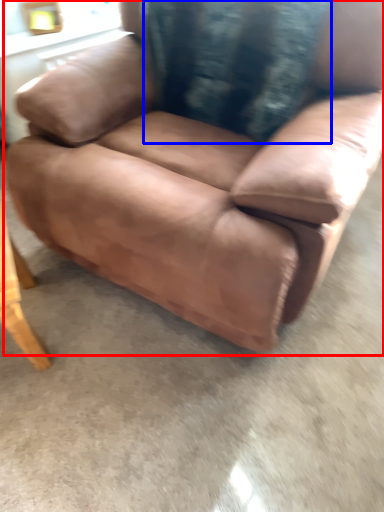
Question: Which of the following is the closest to the observer, chair (highlighted by a red box) or pillow (highlighted by a blue box)?

Choices:
 (A) chair
 (B) pillow

Answer: (A)